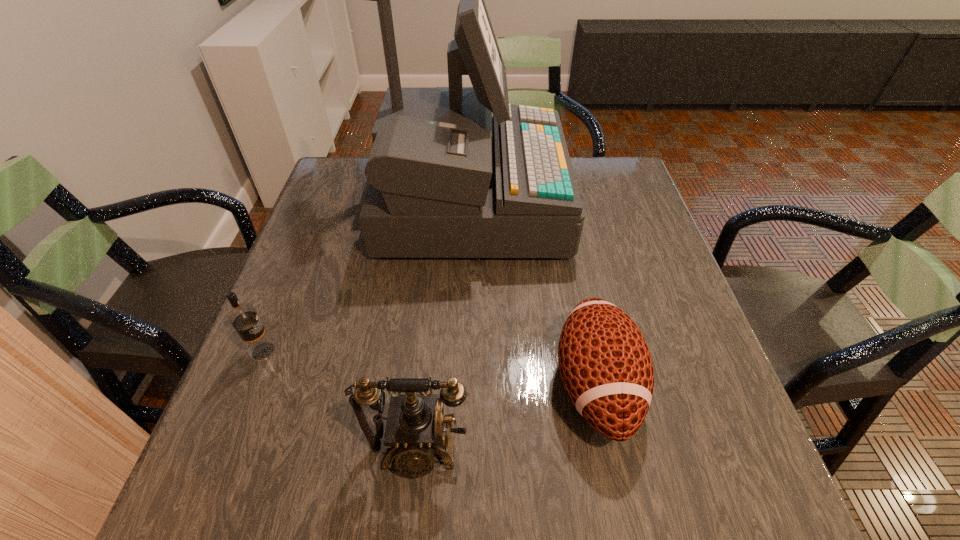
Find the location of a particular element. This screenshot has width=960, height=540. vacant space that satisfies the following two spatial constraints: 1. on the customer-facing side of the tallest object; 2. on the back side of the football is located at coordinates (463, 386).